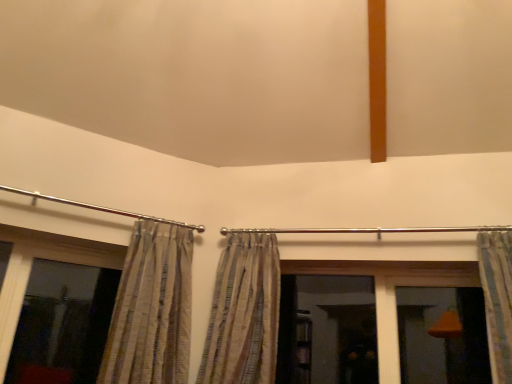
Question: Is the position of striped fabric curtain at left, which is the first curtain in left-to-right order, more distant than that of striped fabric curtain at right, the third curtain when ordered from left to right?

Choices:
 (A) no
 (B) yes

Answer: (B)

Question: Can you see striped fabric curtain at left, which is the first curtain in left-to-right order, touching striped fabric curtain at right, which ranks as the 1th curtain in right-to-left order?

Choices:
 (A) no
 (B) yes

Answer: (A)

Question: From a real-world perspective, is striped fabric curtain at left, which is the third curtain from right to left, located higher than striped fabric curtain at right, the third curtain when ordered from left to right?

Choices:
 (A) yes
 (B) no

Answer: (B)

Question: Considering the relative sizes of striped fabric curtain at left, which is the third curtain from right to left, and striped fabric curtain at right, which ranks as the 1th curtain in right-to-left order, in the image provided, is striped fabric curtain at left, which is the third curtain from right to left, taller than striped fabric curtain at right, which ranks as the 1th curtain in right-to-left order,?

Choices:
 (A) no
 (B) yes

Answer: (B)

Question: Is striped fabric curtain at left, which is the third curtain from right to left, facing away from striped fabric curtain at right, which ranks as the 1th curtain in right-to-left order?

Choices:
 (A) no
 (B) yes

Answer: (A)

Question: From a real-world perspective, is transparent glass window at left positioned above or below striped fabric curtain at center, which is the second curtain from right to left?

Choices:
 (A) above
 (B) below

Answer: (B)

Question: Based on their sizes in the image, would you say transparent glass window at left is bigger or smaller than striped fabric curtain at center, which is the second curtain from right to left?

Choices:
 (A) big
 (B) small

Answer: (B)

Question: Is transparent glass window at left inside or outside of striped fabric curtain at center, which is the second curtain from right to left?

Choices:
 (A) outside
 (B) inside

Answer: (A)

Question: Considering the positions of transparent glass window at left and striped fabric curtain at center, marked as the second curtain in a left-to-right arrangement, in the image, is transparent glass window at left taller or shorter than striped fabric curtain at center, marked as the second curtain in a left-to-right arrangement,?

Choices:
 (A) short
 (B) tall

Answer: (A)

Question: From the image's perspective, is striped fabric curtain at right, which ranks as the 1th curtain in right-to-left order, positioned above or below transparent glass window at left?

Choices:
 (A) above
 (B) below

Answer: (A)

Question: Is striped fabric curtain at right, which ranks as the 1th curtain in right-to-left order, to the left or to the right of transparent glass window at left in the image?

Choices:
 (A) right
 (B) left

Answer: (A)

Question: Is striped fabric curtain at right, which ranks as the 1th curtain in right-to-left order, inside the boundaries of transparent glass window at left, or outside?

Choices:
 (A) outside
 (B) inside

Answer: (A)

Question: In terms of width, does striped fabric curtain at right, which ranks as the 1th curtain in right-to-left order, look wider or thinner when compared to transparent glass window at left?

Choices:
 (A) thin
 (B) wide

Answer: (B)

Question: Is striped fabric curtain at center, which is the second curtain from right to left, in front of or behind transparent glass window at left in the image?

Choices:
 (A) behind
 (B) front

Answer: (B)

Question: From a real-world perspective, is striped fabric curtain at center, marked as the second curtain in a left-to-right arrangement, physically located above or below transparent glass window at left?

Choices:
 (A) below
 (B) above

Answer: (B)